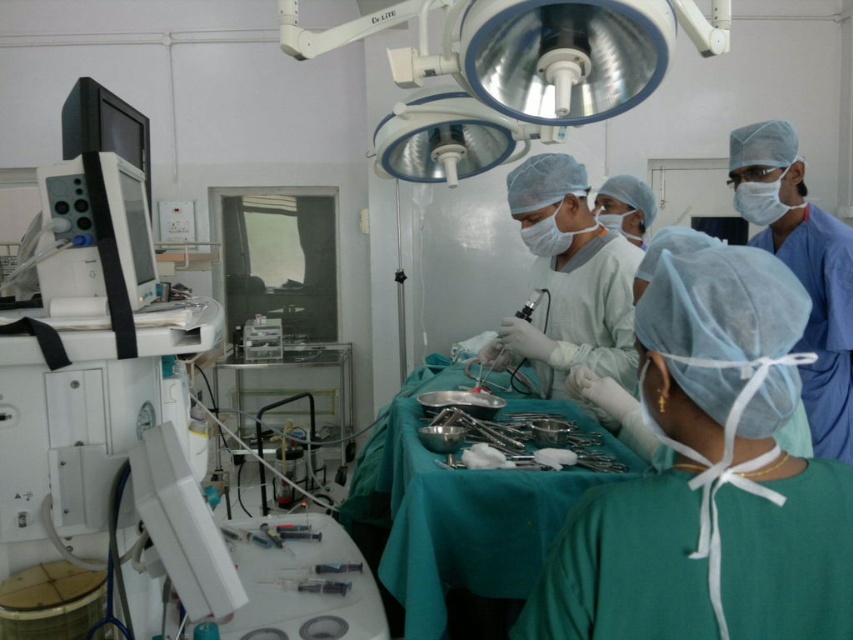
You are a medical student observing the surgical team in the operating room. You notice the green surgical gown at center and the blue smooth scrubs at right. Which of these two items takes up more physical space in the scene?

The blue smooth scrubs at right take up more physical space in the scene than the green surgical gown at center because the green surgical gown at center occupies less space than blue smooth scrubs at right.

You are a medical student observing the surgical procedure. You need to identify which object is closer to you between the white smooth surgical gown at center and the clear plastic syringe at lower center. Which one is closer?

The white smooth surgical gown at center is closer to you than the clear plastic syringe at lower center because it is further to the viewer, meaning it appears nearer in the image.

You are a medical student observing the surgery and need to locate the clear plastic syringe at lower center. According to the coordinates provided, where would you find it?

The clear plastic syringe at lower center is located at point (309, 584).